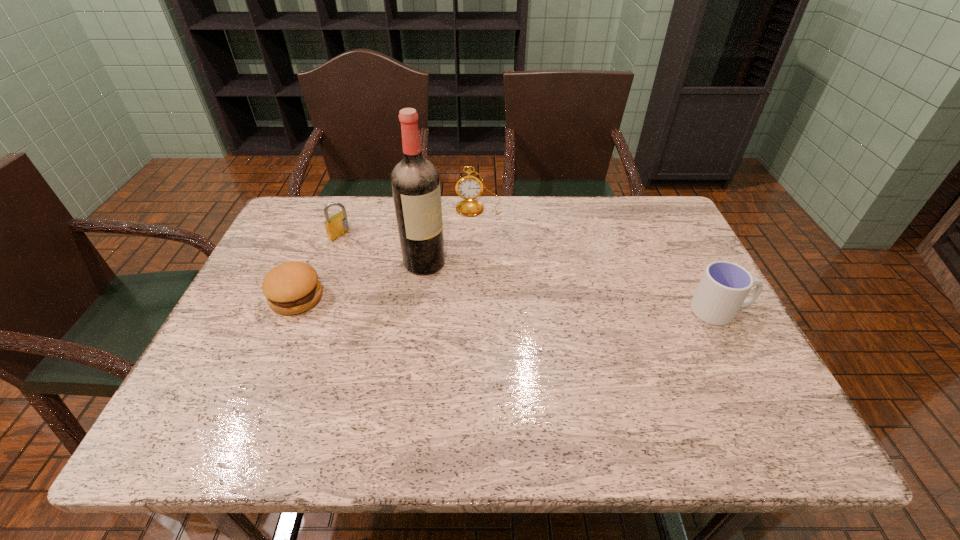
Locate which object is the closest to the fourth nearest object. Please provide its 2D coordinates. Your answer should be formatted as a tuple, i.e. [(x, y)], where the tuple contains the x and y coordinates of a point satisfying the conditions above.

[(290, 288)]

Locate an element on the screen. blank area in the image that satisfies the following two spatial constraints: 1. on the front side of the farthest object; 2. with the handle on the side of the cup is located at coordinates (478, 311).

Find the location of a particular element. The width and height of the screenshot is (960, 540). vacant space that satisfies the following two spatial constraints: 1. on the back side of the padlock; 2. on the right side of the pocket watch is located at coordinates (351, 206).

The image size is (960, 540). In order to click on vacant area that satisfies the following two spatial constraints: 1. on the front side of the cup; 2. with the handle on the side of the second object from right to left in this screenshot , I will do `click(478, 311)`.

The width and height of the screenshot is (960, 540). What are the coordinates of `vacant area in the image that satisfies the following two spatial constraints: 1. on the front side of the padlock; 2. with the handle on the side of the cup` in the screenshot? It's located at (313, 311).

You are a GUI agent. You are given a task and a screenshot of the screen. Output one action in this format:
    pyautogui.click(x=<x>, y=<y>)
    Task: Click on the blank area in the image that satisfies the following two spatial constraints: 1. on the front side of the hamburger; 2. with the handle on the side of the rightmost object
    
    Given the screenshot: What is the action you would take?
    [291, 311]